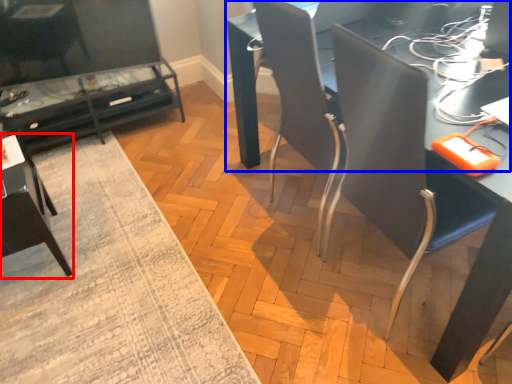
Question: Which point is closer to the camera, armchair (highlighted by a red box) or table (highlighted by a blue box)?

Choices:
 (A) armchair
 (B) table

Answer: (B)